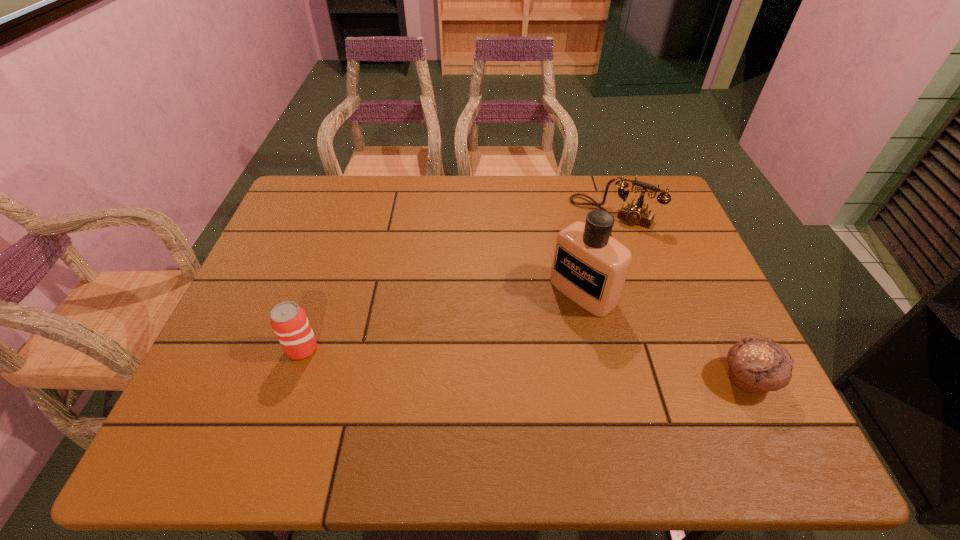
Where is `vacant area located 0.390m on the front label of the second farthest object`? The image size is (960, 540). vacant area located 0.390m on the front label of the second farthest object is located at coordinates (x=438, y=406).

At what (x,y) coordinates should I click in order to perform the action: click on free location located 0.080m on the front label of the second farthest object. Please return your answer as a coordinate pair (x, y). The height and width of the screenshot is (540, 960). Looking at the image, I should click on (540, 326).

The image size is (960, 540). I want to click on vacant area situated on the front label of the second farthest object, so click(x=540, y=326).

Locate an element on the screen. object that is at the far edge is located at coordinates (636, 213).

At what (x,y) coordinates should I click in order to perform the action: click on object that is at the near edge. Please return your answer as a coordinate pair (x, y). This screenshot has height=540, width=960. Looking at the image, I should click on (757, 365).

Identify the location of object present at the left edge. This screenshot has height=540, width=960. (289, 321).

Where is `muffin located at the right edge`? The image size is (960, 540). muffin located at the right edge is located at coordinates (757, 365).

This screenshot has width=960, height=540. I want to click on telephone located in the right edge section of the desktop, so click(x=636, y=213).

This screenshot has height=540, width=960. Find the location of `object present at the far right corner`. object present at the far right corner is located at coordinates (636, 213).

This screenshot has width=960, height=540. I want to click on object present at the near right corner, so click(x=757, y=365).